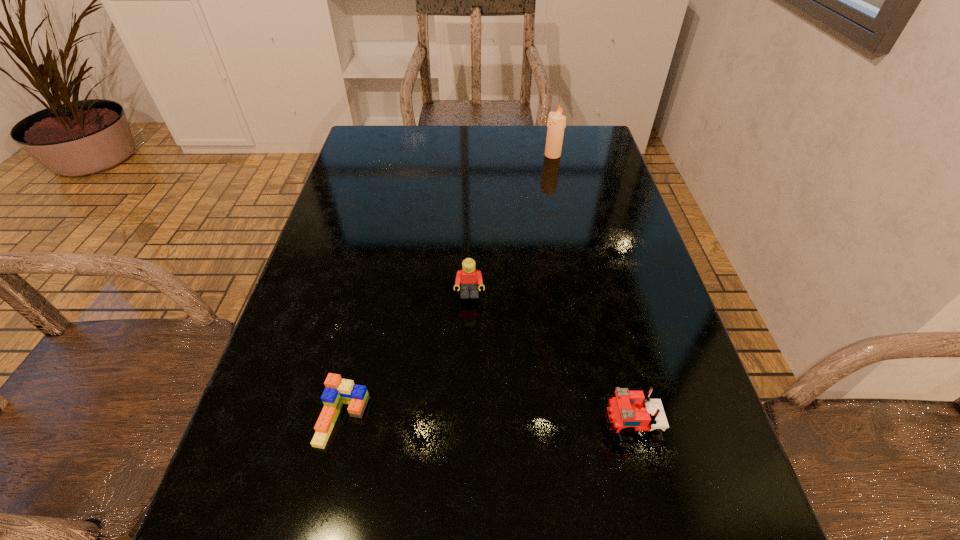
Identify the location of the farthest object. This screenshot has width=960, height=540. (556, 124).

The height and width of the screenshot is (540, 960). I want to click on the tallest object, so click(556, 124).

Where is `the farthest Lego`? This screenshot has height=540, width=960. the farthest Lego is located at coordinates (469, 279).

Locate an element on the screen. Image resolution: width=960 pixels, height=540 pixels. the second Lego from right to left is located at coordinates (469, 279).

You are a GUI agent. You are given a task and a screenshot of the screen. Output one action in this format:
    pyautogui.click(x=<x>, y=<y>)
    Task: Click on the rightmost Lego
    Image resolution: width=960 pixels, height=540 pixels.
    Given the screenshot: What is the action you would take?
    pyautogui.click(x=630, y=410)

Find the location of a particular element. the leftmost object is located at coordinates (338, 391).

Where is `the shortest object`? Image resolution: width=960 pixels, height=540 pixels. the shortest object is located at coordinates (338, 391).

I want to click on vacant position located 0.170m on the front of the farthest object, so click(561, 194).

Locate an element on the screen. The image size is (960, 540). free spot located on the face of the third object from right to left is located at coordinates (468, 343).

Locate an element on the screen. This screenshot has height=540, width=960. free region located 0.070m on the front-facing side of the rightmost Lego is located at coordinates (x=561, y=426).